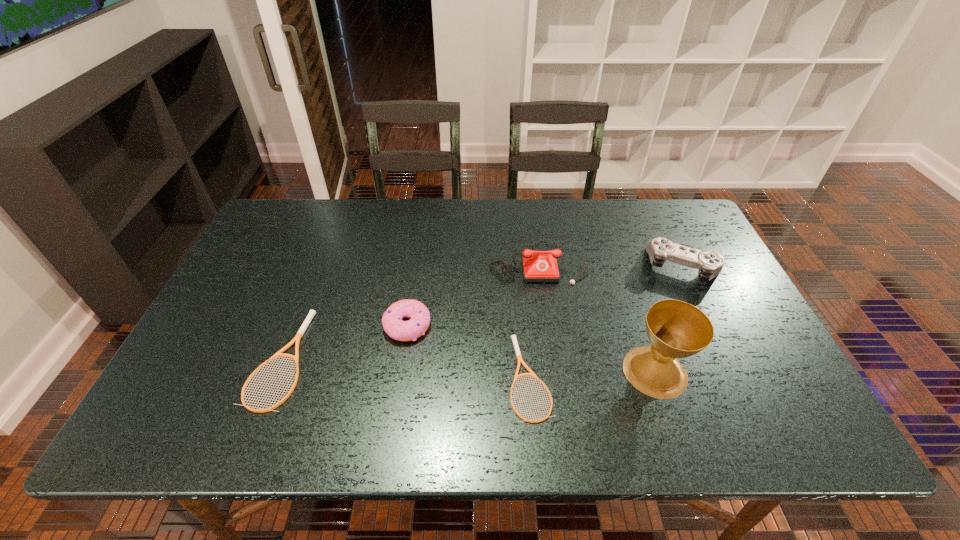
This screenshot has width=960, height=540. I want to click on vacant space located 0.380m on the right of the fifth tallest object, so click(465, 359).

Where is `free point located 0.100m on the right of the shorter tennis racket`? Image resolution: width=960 pixels, height=540 pixels. free point located 0.100m on the right of the shorter tennis racket is located at coordinates (594, 377).

Where is `free space located 0.120m on the dial of the telephone`? The width and height of the screenshot is (960, 540). free space located 0.120m on the dial of the telephone is located at coordinates (545, 319).

Where is `vacant point located on the right of the fourth tallest object`? This screenshot has height=540, width=960. vacant point located on the right of the fourth tallest object is located at coordinates (533, 326).

Where is `vacant space located 0.160m on the front of the rightmost object`? The image size is (960, 540). vacant space located 0.160m on the front of the rightmost object is located at coordinates (717, 336).

This screenshot has height=540, width=960. What are the coordinates of `free space located 0.170m on the back of the second object from right to left` in the screenshot? It's located at pos(630,297).

Where is `object that is at the far edge`? object that is at the far edge is located at coordinates (541, 267).

Find the location of a particular element. chalice that is at the near edge is located at coordinates (676, 329).

Locate an element on the screen. The width and height of the screenshot is (960, 540). object that is at the left edge is located at coordinates (311, 314).

Where is `object that is at the right edge`? object that is at the right edge is located at coordinates (709, 264).